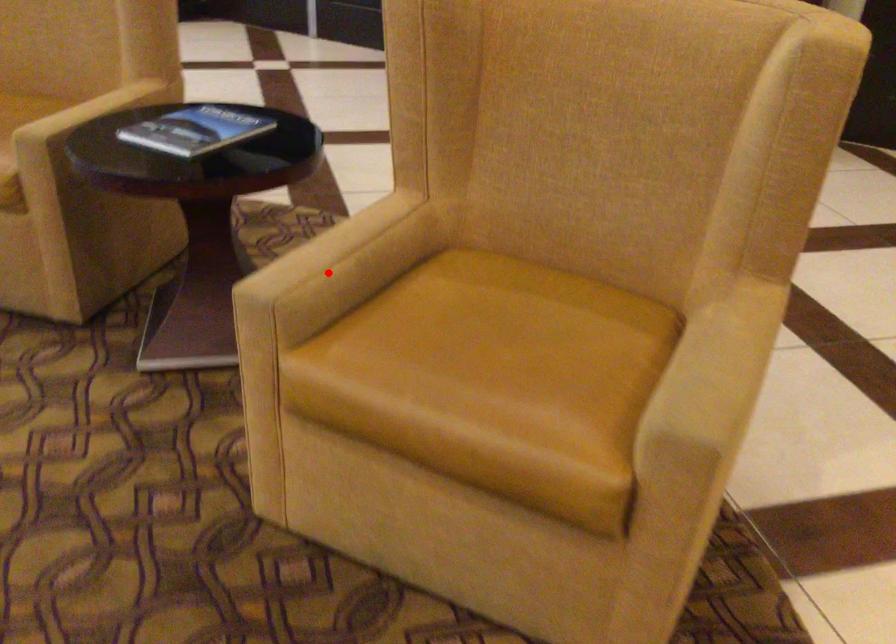
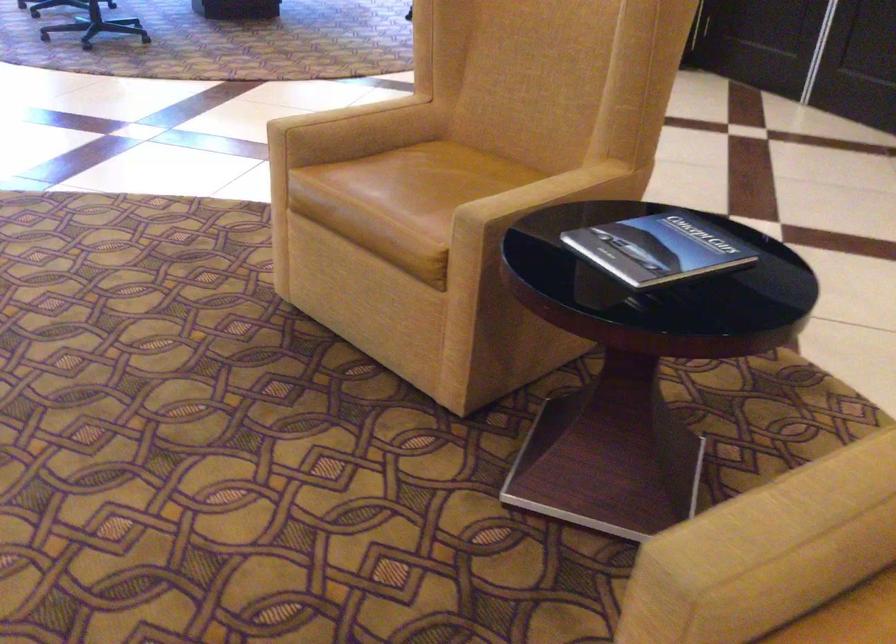
Question: I am providing you with two images of the same scene from different viewpoints. In image1, a red point is highlighted. Considering the same 3D point in image2, which of the following is correct?

Choices:
 (A) It is closer
 (B) It is farther

Answer: (A)